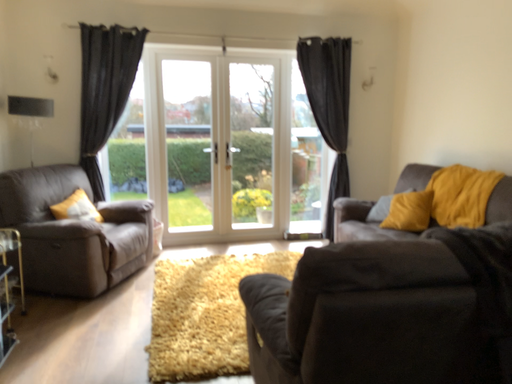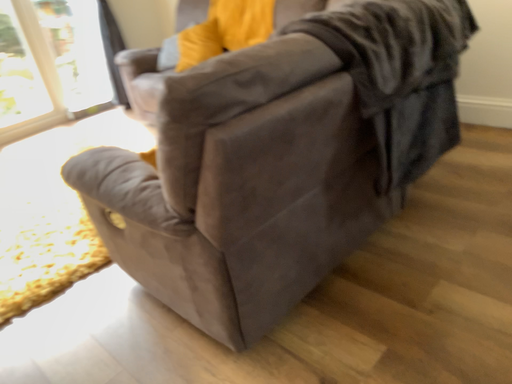
Question: How did the camera likely rotate when shooting the video?

Choices:
 (A) rotated left
 (B) rotated right

Answer: (B)